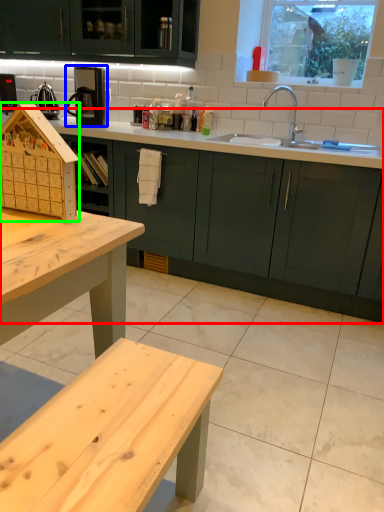
Question: Based on their relative distances, which object is farther from countertop (highlighted by a red box)? Choose from coffee machine (highlighted by a blue box) and appliance (highlighted by a green box).

Choices:
 (A) coffee machine
 (B) appliance

Answer: (B)